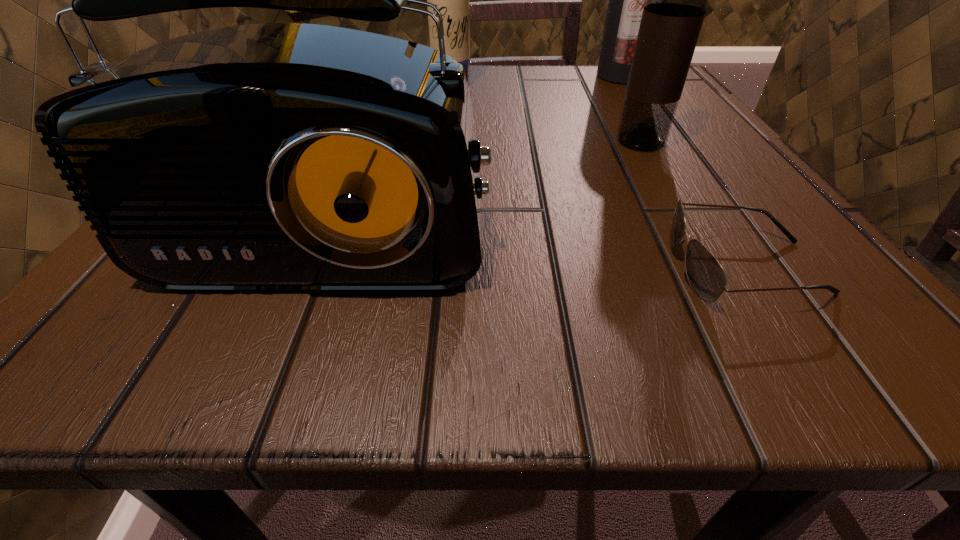
You are a GUI agent. You are given a task and a screenshot of the screen. Output one action in this format:
    pyautogui.click(x=<x>, y=<y>)
    Task: Click on the sunglasses that is at the near edge
    This screenshot has height=540, width=960.
    Given the screenshot: What is the action you would take?
    pyautogui.click(x=707, y=278)

Find the location of a particular element. Image resolution: width=960 pixels, height=540 pixels. object that is at the left edge is located at coordinates (275, 156).

Identify the location of sunglasses that is at the right edge. (707, 278).

The image size is (960, 540). Find the location of `object that is at the near left corner`. object that is at the near left corner is located at coordinates (275, 156).

Locate an element on the screen. This screenshot has width=960, height=540. object at the far right corner is located at coordinates (626, 0).

You are a GUI agent. You are given a task and a screenshot of the screen. Output one action in this format:
    pyautogui.click(x=<x>, y=<y>)
    Task: Click on the object present at the near right corner
    This screenshot has height=540, width=960.
    Given the screenshot: What is the action you would take?
    pyautogui.click(x=707, y=278)

Where is `blank space at the far edge`? Image resolution: width=960 pixels, height=540 pixels. blank space at the far edge is located at coordinates (569, 68).

The height and width of the screenshot is (540, 960). In the image, there is a desktop. In order to click on vacant space at the near edge in this screenshot , I will do `click(662, 352)`.

In order to click on vacant space at the right edge of the desktop in this screenshot , I will do `click(708, 144)`.

In the image, there is a desktop. Where is `vacant space at the far right corner`? The height and width of the screenshot is (540, 960). vacant space at the far right corner is located at coordinates (589, 85).